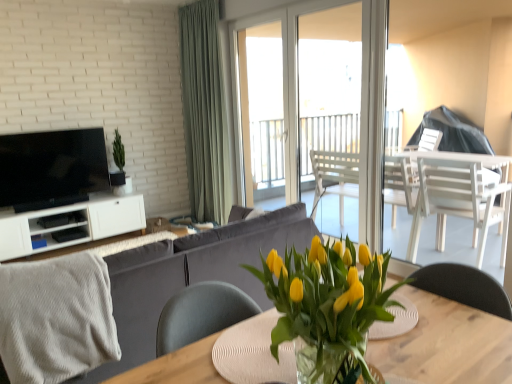
In order to face matte black tv at left, should I rotate leftwards or rightwards?

Rotate your view left by about 25.157°.

The image size is (512, 384). What do you see at coordinates (204, 112) in the screenshot? I see `green fabric curtain at center` at bounding box center [204, 112].

Identify the location of transparent glass door at center. (283, 84).

Measure the distance between transparent glass door at center and camera.

4.21 meters.

I want to click on white matte cabinet at left, so click(70, 224).

Find the location of a particular element. Image resolution: width=512 pixels, height=384 pixels. wooden table at center is located at coordinates (447, 344).

Consider the image. Measure the distance between point (357, 370) and camera.

38.03 inches.

Locate an element on the screen. matte black tv at left is located at coordinates (52, 168).

From a real-world perspective, is yellow matte tulips at center under wooden table at center?

No, from a real-world perspective, yellow matte tulips at center is not under wooden table at center.

Is yellow matte tulips at center situated inside wooden table at center or outside?

yellow matte tulips at center is not enclosed by wooden table at center.

Which is more to the right, yellow matte tulips at center or wooden table at center?

From the viewer's perspective, wooden table at center appears more on the right side.

Is transparent glass door at center closer to the viewer compared to matte black tv at left?

No, it is behind matte black tv at left.

Which of these two, transparent glass door at center or matte black tv at left, is thinner?

Thinner between the two is transparent glass door at center.

The height and width of the screenshot is (384, 512). I want to click on television in front of the transparent glass door at center, so click(x=52, y=168).

From the image's perspective, relative to matte black tv at left, is transparent glass door at center above or below?

Based on their image positions, transparent glass door at center is located above matte black tv at left.

Is wooden table at center positioned far away from textured gray blanket at lower left?

Yes, wooden table at center is far from textured gray blanket at lower left.

Between wooden table at center and textured gray blanket at lower left, which one has larger size?

With larger size is wooden table at center.

Do you think wooden table at center is within textured gray blanket at lower left, or outside of it?

The correct answer is: outside.

Is point (443, 331) farther from viewer compared to point (71, 353)?

No, it is not.

In order to click on cabinetry above the velvet grey couch at center (from the image's perspective) in this screenshot , I will do pyautogui.click(x=70, y=224).

How distant is velvet grey couch at center from white matte cabinet at left?

velvet grey couch at center is 2.60 meters from white matte cabinet at left.

From the image's perspective, between velvet grey couch at center and white matte cabinet at left, who is located below?

From the image's view, velvet grey couch at center is below.

Is velvet grey couch at center aimed at white matte cabinet at left?

Yes, velvet grey couch at center is turned towards white matte cabinet at left.

Based on the photo, considering the relative sizes of matte black tv at left and yellow matte tulips at center in the image provided, is matte black tv at left shorter than yellow matte tulips at center?

No, matte black tv at left is not shorter than yellow matte tulips at center.

Where is `houseplant below the matte black tv at left (from the image's perspective)`? The image size is (512, 384). houseplant below the matte black tv at left (from the image's perspective) is located at coordinates (327, 306).

Are matte black tv at left and yellow matte tulips at center far apart?

Yes, matte black tv at left and yellow matte tulips at center are located far from each other.

From the image's perspective, which is below, transparent glass door at center or transparent glass door at center?

From the image's view, transparent glass door at center is below.

Choose the correct answer: Is transparent glass door at center inside transparent glass door at center or outside it?

transparent glass door at center can be found inside transparent glass door at center.

The width and height of the screenshot is (512, 384). I want to click on window screen above the transparent glass door at center (from a real-world perspective), so click(x=261, y=107).

Considering the sizes of objects transparent glass door at center and transparent glass door at center in the image provided, who is bigger, transparent glass door at center or transparent glass door at center?

transparent glass door at center is bigger.

Can you confirm if transparent glass door at center is positioned to the right of velvet grey couch at center?

Yes.

Is transparent glass door at center far away from velvet grey couch at center?

That's right, there is a large distance between transparent glass door at center and velvet grey couch at center.

From the image's perspective, between transparent glass door at center and velvet grey couch at center, which one is located above?

transparent glass door at center is shown above in the image.

Is transparent glass door at center oriented towards velvet grey couch at center?

No.

Locate an element on the screen. The image size is (512, 384). houseplant above the wooden table at center (from the image's perspective) is located at coordinates (327, 306).

The image size is (512, 384). In order to click on television that appears on the left of transparent glass door at center in this screenshot , I will do `click(52, 168)`.

From the image, which object appears to be farther from textured gray blanket at lower left, green fabric curtain at center or transparent glass door at center?

transparent glass door at center lies further to textured gray blanket at lower left than the other object.

Estimate the real-world distances between objects in this image. Which object is closer to velvet grey couch at center, yellow matte tulips at center or wooden table at center?

wooden table at center is positioned closer to the anchor velvet grey couch at center.

Based on their spatial positions, is wooden table at center or matte black tv at left closer to translucent glass vase at center?

wooden table at center.

Based on their spatial positions, is transparent glass door at center or green fabric curtain at center closer to transparent glass door at center?

transparent glass door at center lies closer to transparent glass door at center than the other object.

Based on their spatial positions, is translucent glass vase at center or velvet grey couch at center closer to yellow matte tulips at center?

translucent glass vase at center is positioned closer to the anchor yellow matte tulips at center.

Looking at the image, which one is located further to translucent glass vase at center, green fabric curtain at center or transparent glass door at center?

green fabric curtain at center lies further to translucent glass vase at center than the other object.

Consider the image. Which object lies further to the anchor point white matte cabinet at left, velvet grey couch at center or textured gray blanket at lower left?

Among the two, textured gray blanket at lower left is located further to white matte cabinet at left.

Based on their spatial positions, is textured gray blanket at lower left or velvet grey couch at center further from yellow matte tulips at center?

textured gray blanket at lower left is positioned further to the anchor yellow matte tulips at center.

Image resolution: width=512 pixels, height=384 pixels. Identify the location of cabinetry between yellow matte tulips at center and transparent glass door at center from front to back. (70, 224).

What are the coordinates of `studio couch between textured gray blanket at lower left and yellow matte tulips at center` in the screenshot? It's located at (190, 276).

Identify the location of vase between wooden table at center and velvet grey couch at center along the z-axis. This screenshot has height=384, width=512. tap(325, 365).

The width and height of the screenshot is (512, 384). I want to click on television between velvet grey couch at center and white matte cabinet at left in the front-back direction, so click(52, 168).